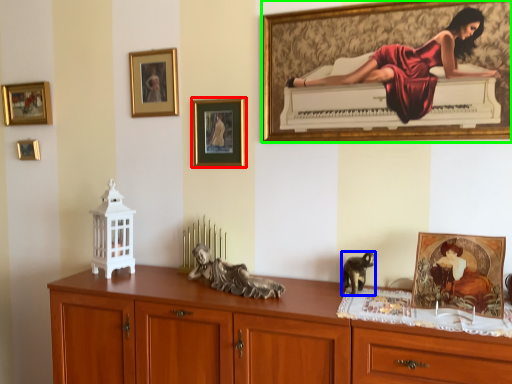
Question: Considering the real-world distances, which object is closest to picture frame (highlighted by a red box)? animal (highlighted by a blue box) or picture frame (highlighted by a green box).

Choices:
 (A) animal
 (B) picture frame

Answer: (B)